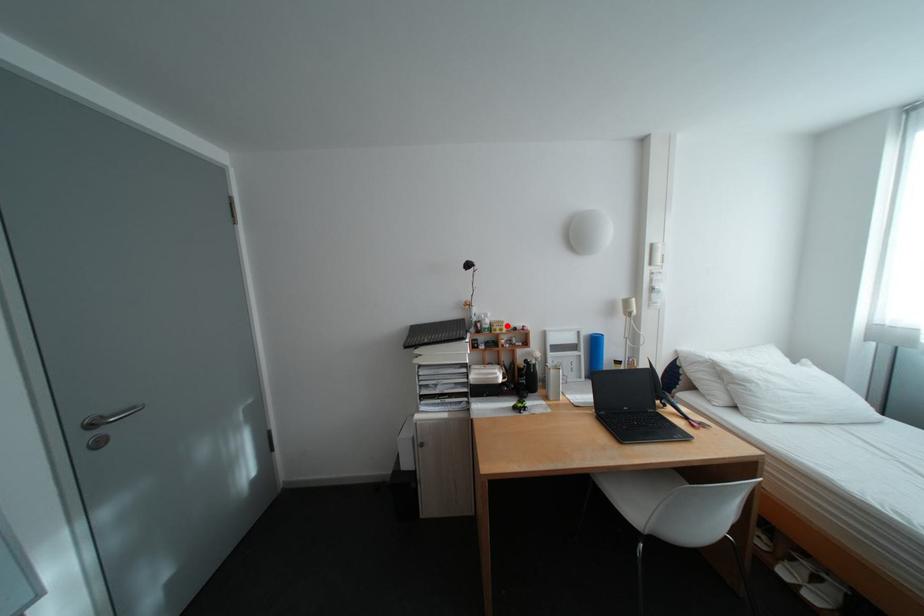
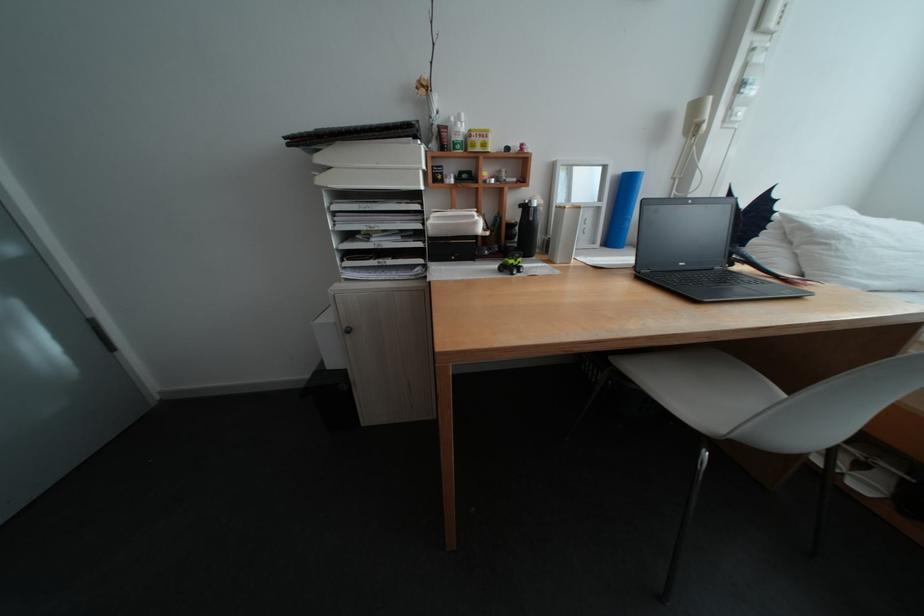
The point at the highlighted location is marked in the first image. Where is the corresponding point in the second image?

(485, 135)